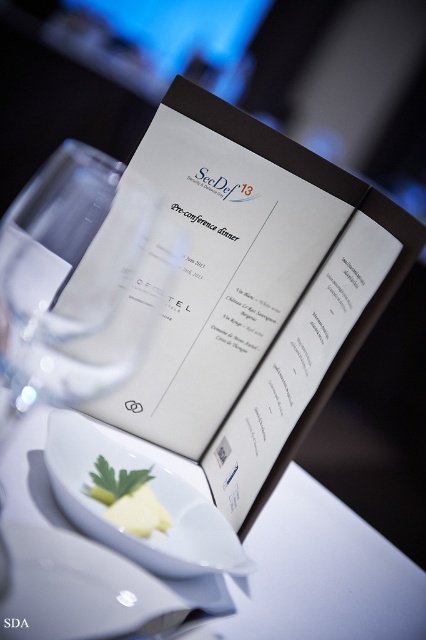
Is white paper menu at center positioned in front of yellow butter at center?

No, white paper menu at center is behind yellow butter at center.

Is white paper menu at center further to the viewer compared to yellow butter at center?

Yes, it is behind yellow butter at center.

Who is more forward, [147,154] or [112,490]?

Positioned in front is point [112,490].

Find the location of a particular element. The height and width of the screenshot is (640, 426). white paper menu at center is located at coordinates (255, 294).

Which of these two, white glossy plate at lower center or yellow butter at center, stands shorter?

Standing shorter between the two is yellow butter at center.

Which is in front, point (60, 573) or point (118, 508)?

Point (60, 573) is in front.

Image resolution: width=426 pixels, height=640 pixels. Identify the location of white glossy plate at lower center. (89, 588).

Can you confirm if white glossy plate at lower center is taller than white glossy plate at center?

No.

This screenshot has width=426, height=640. I want to click on white glossy plate at lower center, so click(x=89, y=588).